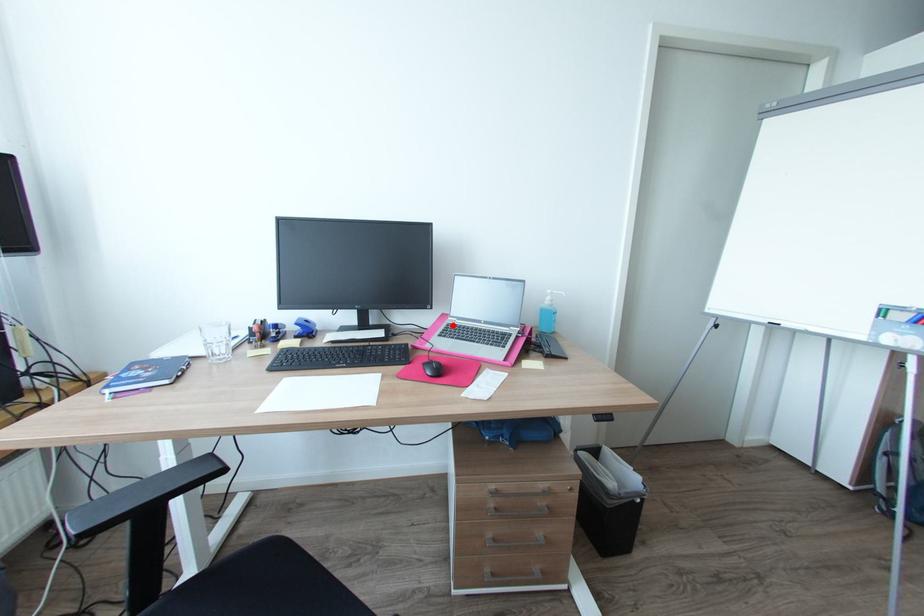
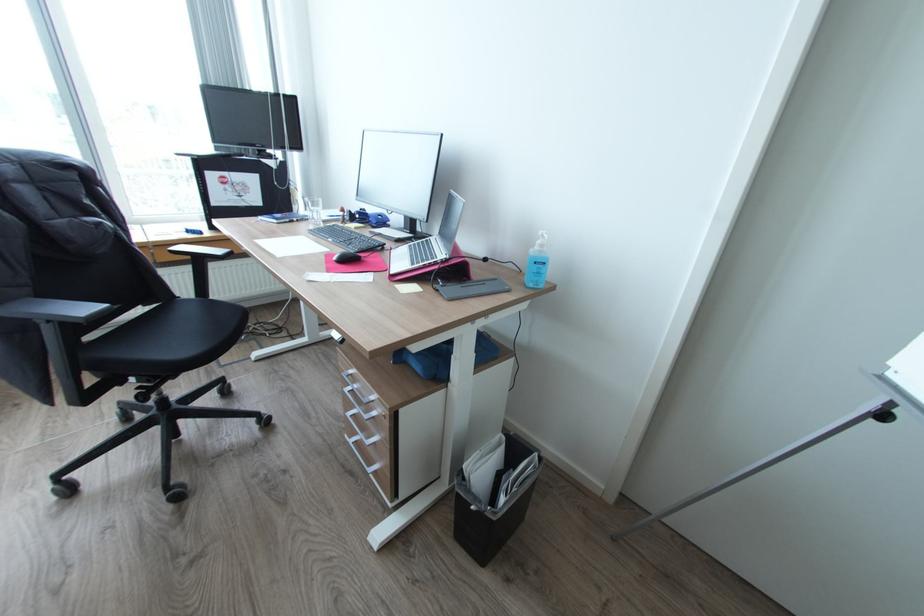
The point at the highlighted location is marked in the first image. Where is the corresponding point in the second image?

(432, 238)